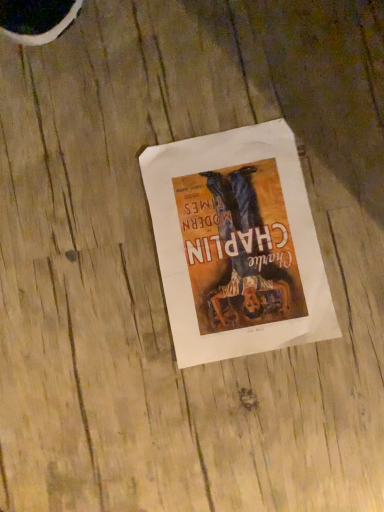
Identify the location of matte paper poster at center. The height and width of the screenshot is (512, 384). click(x=237, y=244).

What is the approximate width of matte paper poster at center?

matte paper poster at center is 11.87 inches in width.

Describe the element at coordinates (237, 244) in the screenshot. I see `matte paper poster at center` at that location.

What are the coordinates of `matte paper poster at center` in the screenshot? It's located at (237, 244).